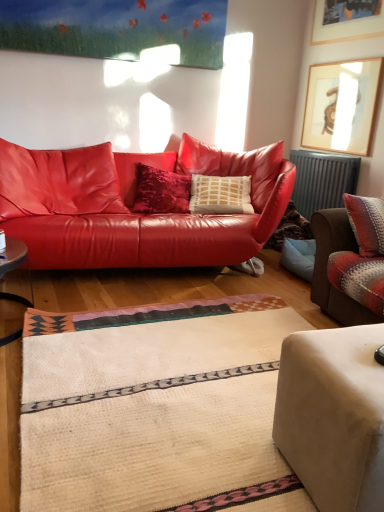
Identify the location of free point above metallic gray radiator at right (from a real-world perspective). This screenshot has height=512, width=384. [x=332, y=148].